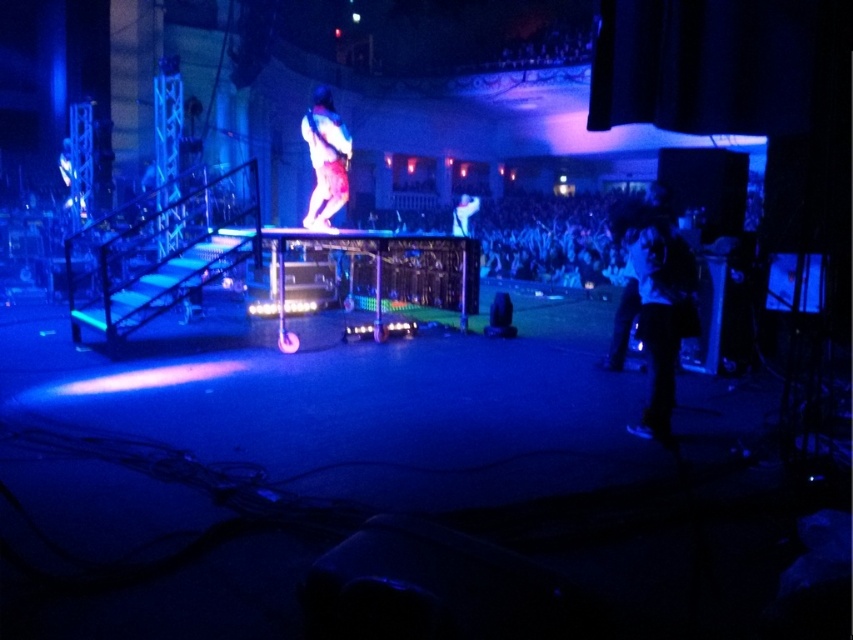
Question: Does black matte jacket at right appear over shiny silver guitar at center?

Choices:
 (A) yes
 (B) no

Answer: (B)

Question: Observing the image, what is the correct spatial positioning of black matte jacket at right in reference to shiny silver guitar at center?

Choices:
 (A) right
 (B) left

Answer: (A)

Question: Which of these objects is positioned closest to the black matte jacket at right?

Choices:
 (A) shiny silver guitar at center
 (B) shiny metallic guitar at center

Answer: (B)

Question: Does shiny metallic guitar at center appear over shiny silver guitar at center?

Choices:
 (A) no
 (B) yes

Answer: (A)

Question: Among these objects, which one is nearest to the camera?

Choices:
 (A) shiny metallic guitar at center
 (B) shiny silver guitar at center
 (C) black matte jacket at right

Answer: (C)

Question: Which point is closer to the camera?

Choices:
 (A) (331, 195)
 (B) (640, 305)

Answer: (B)